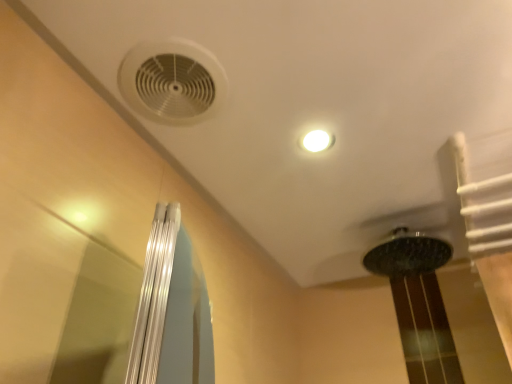
Find the location of a particular element. The image size is (512, 384). white plastic fan at upper left is located at coordinates (172, 82).

This screenshot has height=384, width=512. Describe the element at coordinates (172, 82) in the screenshot. I see `white plastic fan at upper left` at that location.

What is the approximate height of white plastic fan at upper left?

It is 0.44 inches.

Locate an element on the screen. white plastic fan at upper left is located at coordinates (172, 82).